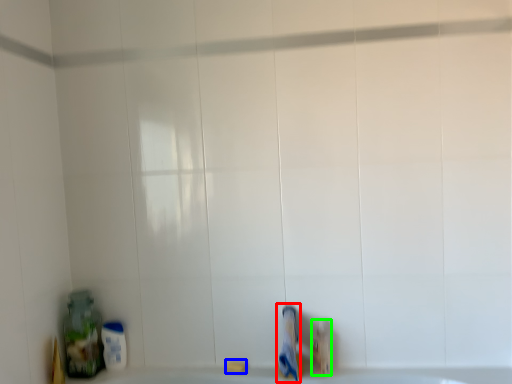
Question: Which object is positioned closest to toothpaste (highlighted by a red box)? Select from soap (highlighted by a blue box) and toiletry (highlighted by a green box).

Choices:
 (A) soap
 (B) toiletry

Answer: (B)